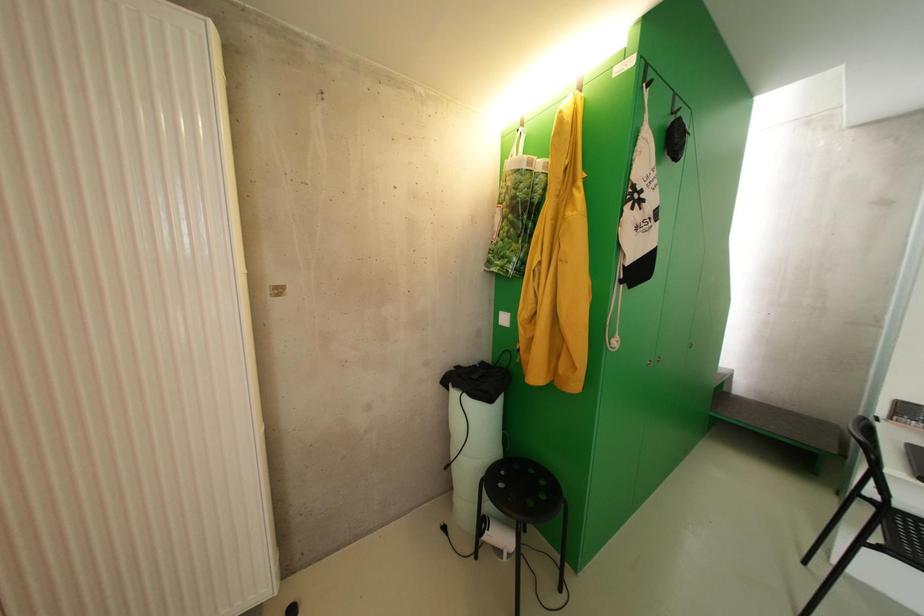
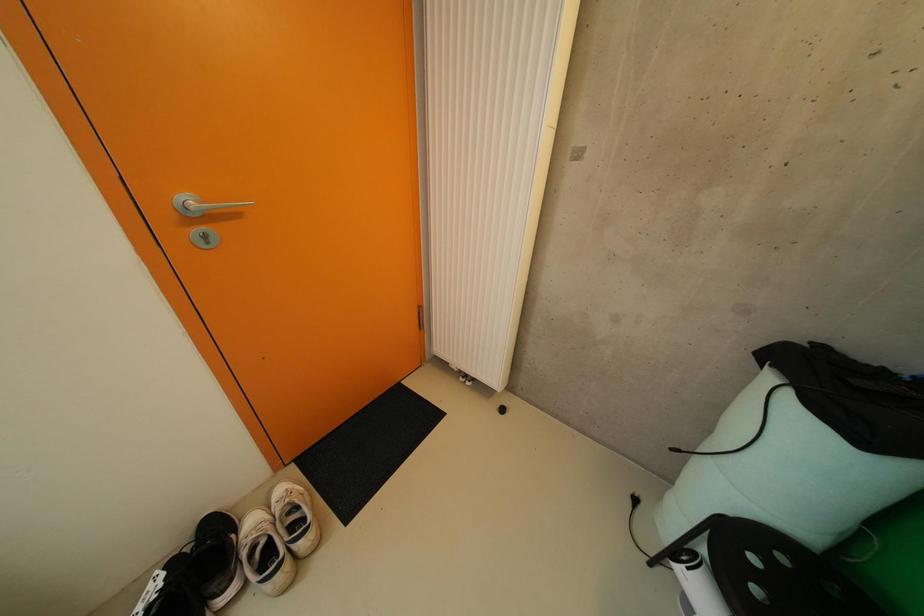
First-person continuous shooting, in which direction is the camera rotating?

The camera rotated toward left-down.